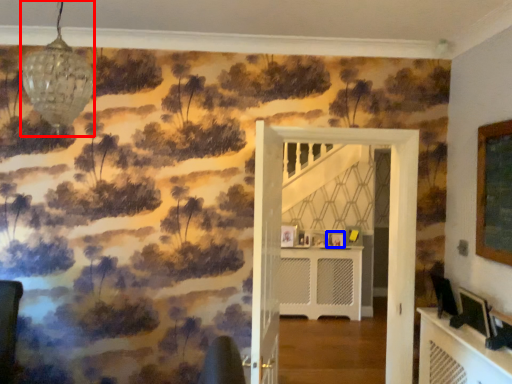
Question: Which object appears closest to the camera in this image, light fixture (highlighted by a red box) or picture frame (highlighted by a blue box)?

Choices:
 (A) light fixture
 (B) picture frame

Answer: (A)